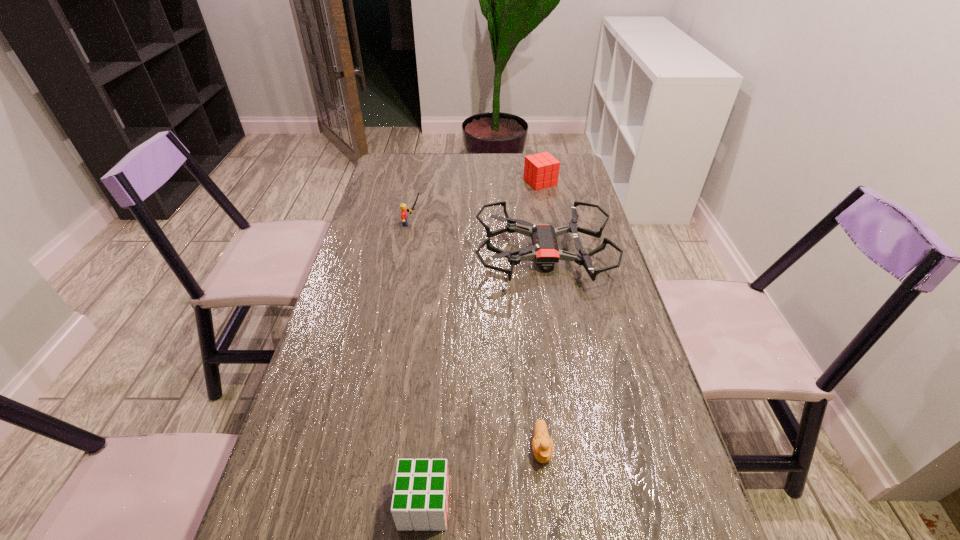
The height and width of the screenshot is (540, 960). Identify the location of free space located 0.080m on the red face of the nearer cube. (492, 505).

Locate an element on the screen. This screenshot has width=960, height=540. vacant position located with the camera facing forward on the drone is located at coordinates (351, 255).

This screenshot has height=540, width=960. I want to click on vacant region located 0.090m with the camera facing forward on the drone, so pos(446,255).

The height and width of the screenshot is (540, 960). I want to click on vacant space situated 0.290m with the camera facing forward on the drone, so click(381, 255).

Where is `vacant position located 0.120m on the face of the duckling`? This screenshot has height=540, width=960. vacant position located 0.120m on the face of the duckling is located at coordinates (551, 537).

Locate an element on the screen. The width and height of the screenshot is (960, 540). object present at the far edge is located at coordinates (541, 170).

Locate an element on the screen. The image size is (960, 540). object that is at the left edge is located at coordinates (404, 210).

Identify the location of cube at the right edge. (541, 170).

Where is `drone at the right edge`? This screenshot has height=540, width=960. drone at the right edge is located at coordinates (545, 251).

I want to click on object situated at the far right corner, so point(541,170).